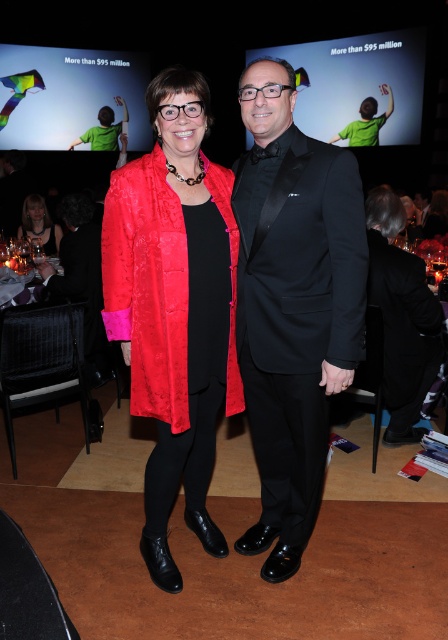
You are standing at the point marked as point (158, 344) in the image. You want to walk straight ahead to the stage backdrop. How far will you have to walk?

The distance of point (158, 344) from viewer is 1.71 meters, so you will have to walk 1.71 meters to reach the stage backdrop.

You are at the event and want to move from point A to point B. Point A is located at coordinates point (159, 176) and point B is at point (87, 131). Since you are facing the stage, which direction should you move to go from point A to point B?

Point (159, 176) is closer to the viewer than point (87, 131), so to move from point A to point B, you should move towards the stage.

You are a photographer at the event and want to capture a clear photo of both the black satin tuxedo at center and the matte red dress at center. Which one will appear larger in the photo?

The black satin tuxedo at center will appear larger in the photo because it is closer to the viewer than the matte red dress at center.